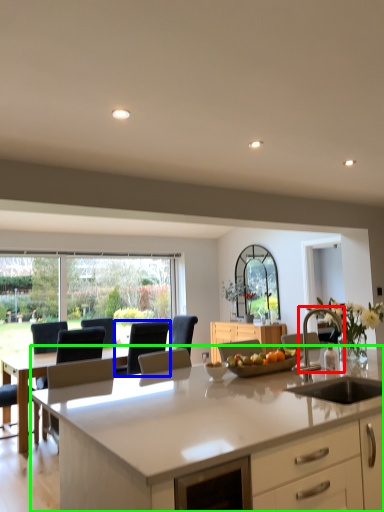
Question: Estimate the real-world distances between objects in this image. Which object is closer to armchair (highlighted by a red box), armchair (highlighted by a blue box) or countertop (highlighted by a green box)?

Choices:
 (A) armchair
 (B) countertop

Answer: (B)